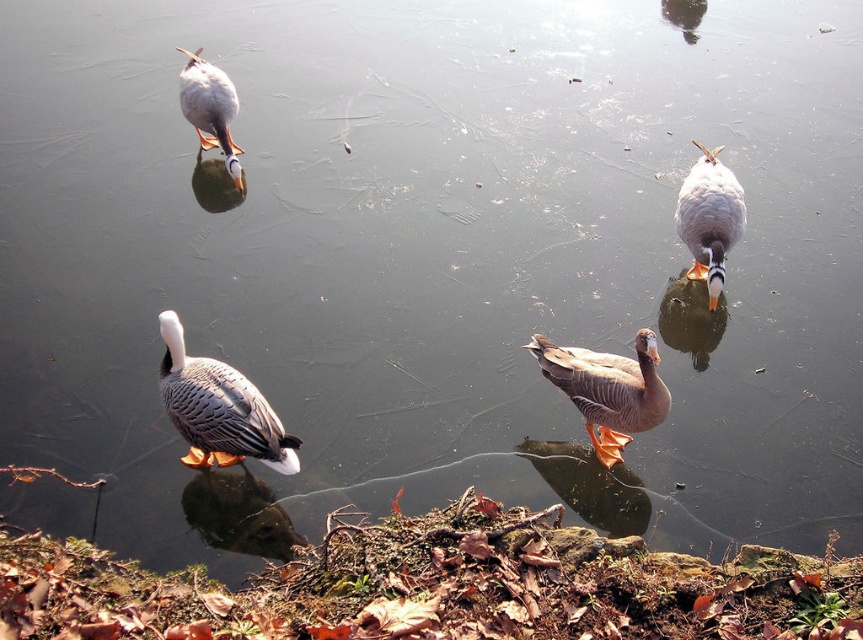
You are a photographer trying to capture the speckled feathered duck at center and the white glossy duck at upper right in the same frame. Based on their sizes, which duck do you think will appear larger in the photo?

The speckled feathered duck at center might appear larger in the photo because it is wider than the white glossy duck at upper right.

You are a wildlife photographer trying to capture a photo of the speckled feathered duck at center and the gray matte duck at center. Which duck should you focus on first if you want to photograph the larger one?

The speckled feathered duck at center is larger in size than the gray matte duck at center, so you should focus on the speckled feathered duck at center first.